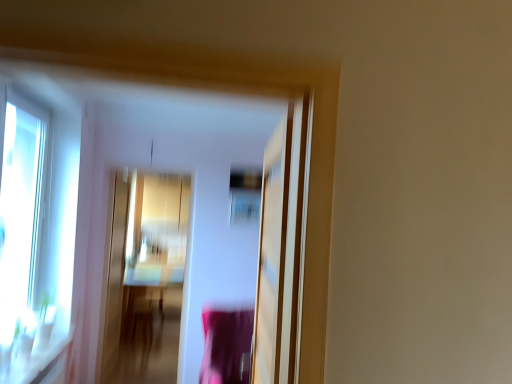
Question: Considering the relative sizes of transparent glass window at left and gold metallic screen door at center, the second screen door positioned from the right, in the image provided, is transparent glass window at left thinner than gold metallic screen door at center, the second screen door positioned from the right,?

Choices:
 (A) no
 (B) yes

Answer: (A)

Question: From the image's perspective, would you say transparent glass window at left is shown under gold metallic screen door at center, which is the 1th screen door in left-to-right order?

Choices:
 (A) no
 (B) yes

Answer: (A)

Question: Is transparent glass window at left at the left side of gold metallic screen door at center, the first screen door viewed from the back?

Choices:
 (A) no
 (B) yes

Answer: (B)

Question: Does transparent glass window at left have a greater height compared to gold metallic screen door at center, the first screen door viewed from the back?

Choices:
 (A) no
 (B) yes

Answer: (A)

Question: Can you confirm if transparent glass window at left is smaller than gold metallic screen door at center, the first screen door viewed from the back?

Choices:
 (A) yes
 (B) no

Answer: (A)

Question: Can you confirm if transparent glass window at left is wider than gold metallic screen door at center, which is counted as the second screen door, starting from the front?

Choices:
 (A) no
 (B) yes

Answer: (B)

Question: Is wooden table at center further to the viewer compared to transparent glass screen door at center, which appears as the 1th screen door when viewed from the front?

Choices:
 (A) yes
 (B) no

Answer: (A)

Question: Does wooden table at center have a greater height compared to transparent glass screen door at center, which is counted as the 1th screen door, starting from the right?

Choices:
 (A) yes
 (B) no

Answer: (B)

Question: Would you consider wooden table at center to be distant from transparent glass screen door at center, the second screen door positioned from the back?

Choices:
 (A) yes
 (B) no

Answer: (A)

Question: Is wooden table at center thinner than transparent glass screen door at center, which appears as the 1th screen door when viewed from the front?

Choices:
 (A) yes
 (B) no

Answer: (B)

Question: Is wooden table at center next to transparent glass screen door at center, the second screen door positioned from the back?

Choices:
 (A) no
 (B) yes

Answer: (A)

Question: Is transparent glass screen door at center, the second screen door positioned from the back, inside wooden table at center?

Choices:
 (A) no
 (B) yes

Answer: (A)

Question: Is transparent glass window at left next to wooden table at center and touching it?

Choices:
 (A) yes
 (B) no

Answer: (B)